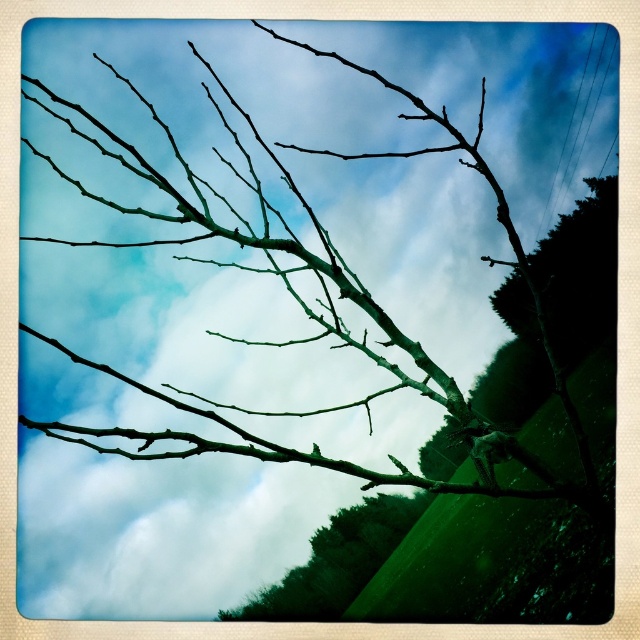
You are an artist sketching the scene and want to place a small bird on the green matte tree branch at right. Based on the scene description, where should you position the bird in terms of the branch?

The green matte tree branch at right is located at point (579, 275), so you should position the bird near that coordinate to accurately place it on the branch.

You are a bird looking for a place to perch. You see the green matte tree branch at right and the green matte tree branch at lower center. Which branch is closer to you?

The green matte tree branch at lower center is closer to you because it is positioned lower in the image than the green matte tree branch at right, which is farther away.